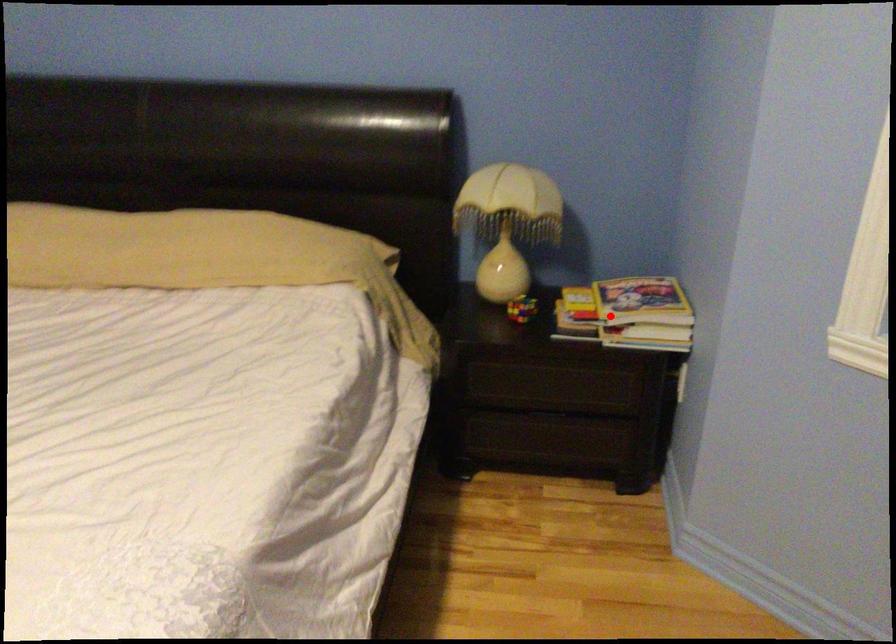
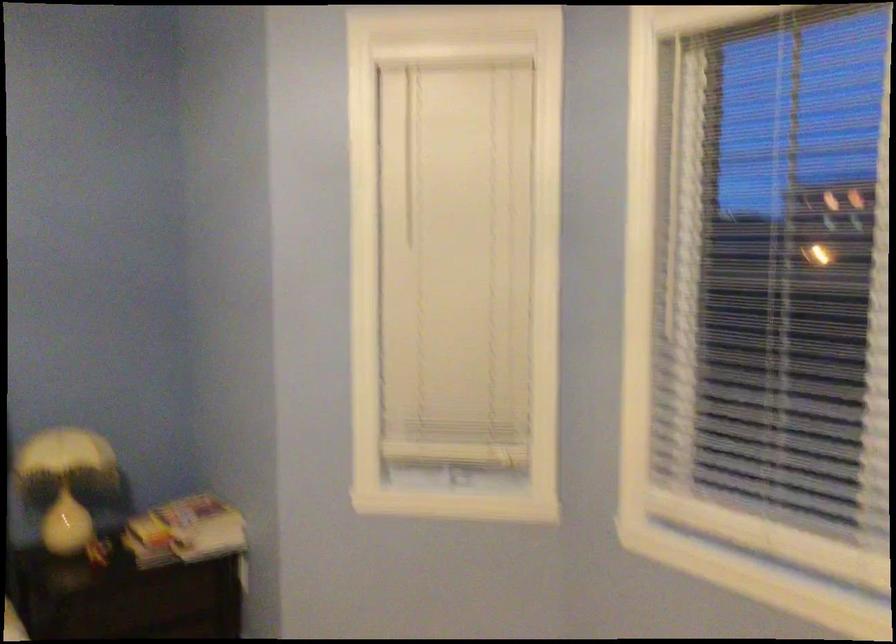
Question: I am providing you with two images of the same scene from different viewpoints. Given a red point in image1, look at the same physical point in image2. Is it:

Choices:
 (A) Closer to the viewpoint
 (B) Farther from the viewpoint

Answer: (B)